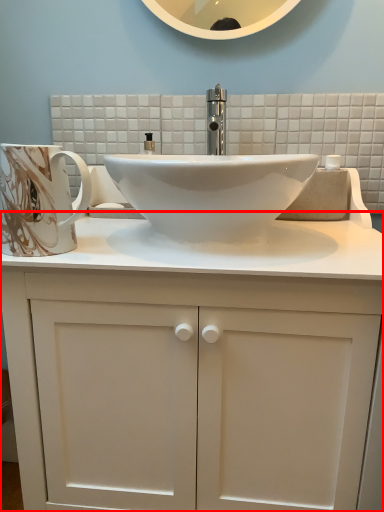
Question: From the image's perspective, what is the correct spatial relationship of bathroom cabinet (annotated by the red box) in relation to mug?

Choices:
 (A) below
 (B) above

Answer: (A)